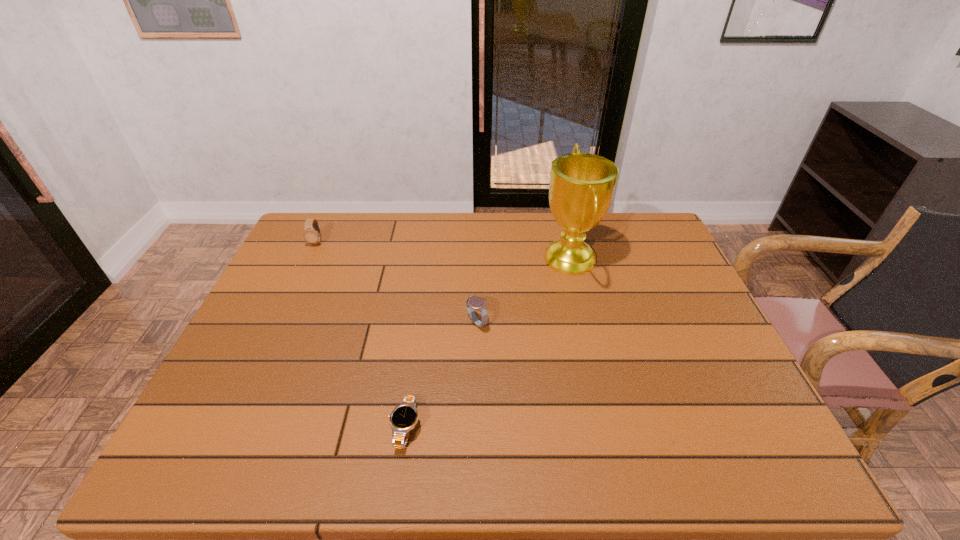
Find the location of a particular element. The height and width of the screenshot is (540, 960). vacant region that satisfies the following two spatial constraints: 1. on the face of the nearest object; 2. on the right side of the farthest watch is located at coordinates (229, 428).

Locate an element on the screen. This screenshot has height=540, width=960. blank area in the image that satisfies the following two spatial constraints: 1. on the face of the second farthest watch; 2. on the left side of the leftmost object is located at coordinates (278, 322).

I want to click on free space that satisfies the following two spatial constraints: 1. on the shiny surface of the rightmost object; 2. on the front side of the nearest watch, so click(612, 428).

The width and height of the screenshot is (960, 540). Find the location of `free region that satisfies the following two spatial constraints: 1. on the face of the shortest object; 2. on the right side of the farthest watch`. free region that satisfies the following two spatial constraints: 1. on the face of the shortest object; 2. on the right side of the farthest watch is located at coordinates (229, 428).